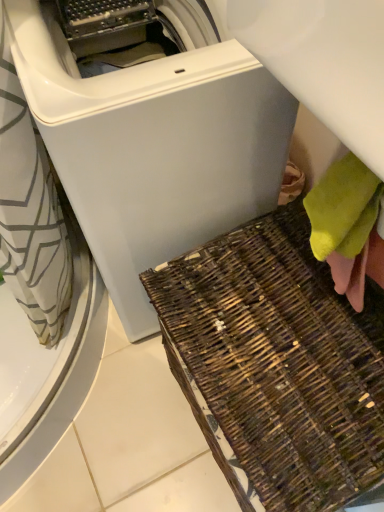
Question: Is soft yellow towel at lower right positioned behind brown woven basket at lower right?

Choices:
 (A) no
 (B) yes

Answer: (B)

Question: Is soft yellow towel at lower right thinner than brown woven basket at lower right?

Choices:
 (A) yes
 (B) no

Answer: (A)

Question: Is soft yellow towel at lower right oriented away from brown woven basket at lower right?

Choices:
 (A) no
 (B) yes

Answer: (A)

Question: From the image's perspective, is soft yellow towel at lower right located above brown woven basket at lower right?

Choices:
 (A) yes
 (B) no

Answer: (A)

Question: Considering the relative positions of soft yellow towel at lower right and brown woven basket at lower right in the image provided, is soft yellow towel at lower right to the right of brown woven basket at lower right from the viewer's perspective?

Choices:
 (A) yes
 (B) no

Answer: (A)

Question: Is brown woven basket at lower right inside or outside of soft yellow towel at lower right?

Choices:
 (A) inside
 (B) outside

Answer: (B)

Question: In the image, is brown woven basket at lower right on the left side or the right side of soft yellow towel at lower right?

Choices:
 (A) left
 (B) right

Answer: (A)

Question: Looking at their shapes, would you say brown woven basket at lower right is wider or thinner than soft yellow towel at lower right?

Choices:
 (A) wide
 (B) thin

Answer: (A)

Question: Is point (297, 252) closer or farther from the camera than point (355, 198)?

Choices:
 (A) closer
 (B) farther

Answer: (B)

Question: Considering the positions of white matte washing machine at center and soft yellow towel at lower right in the image, is white matte washing machine at center wider or thinner than soft yellow towel at lower right?

Choices:
 (A) thin
 (B) wide

Answer: (B)

Question: Would you say white matte washing machine at center is inside or outside soft yellow towel at lower right?

Choices:
 (A) inside
 (B) outside

Answer: (B)

Question: Based on their sizes in the image, would you say white matte washing machine at center is bigger or smaller than soft yellow towel at lower right?

Choices:
 (A) big
 (B) small

Answer: (A)

Question: Based on their positions, is white matte washing machine at center located to the left or right of soft yellow towel at lower right?

Choices:
 (A) right
 (B) left

Answer: (B)

Question: Considering the positions of point (342, 251) and point (228, 440), is point (342, 251) closer or farther from the camera than point (228, 440)?

Choices:
 (A) closer
 (B) farther

Answer: (A)

Question: Is soft yellow towel at lower right bigger or smaller than brown woven basket at lower right?

Choices:
 (A) small
 (B) big

Answer: (A)